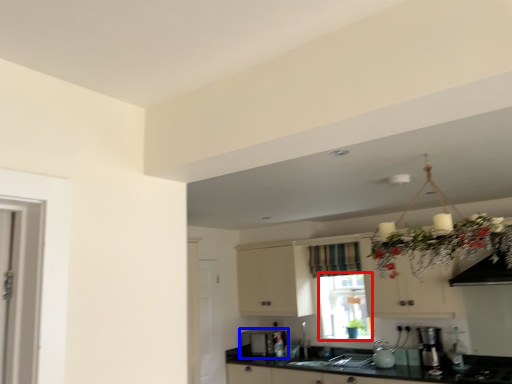
Question: Which point is further to the camera, window screen (highlighted by a red box) or appliance (highlighted by a blue box)?

Choices:
 (A) window screen
 (B) appliance

Answer: (B)